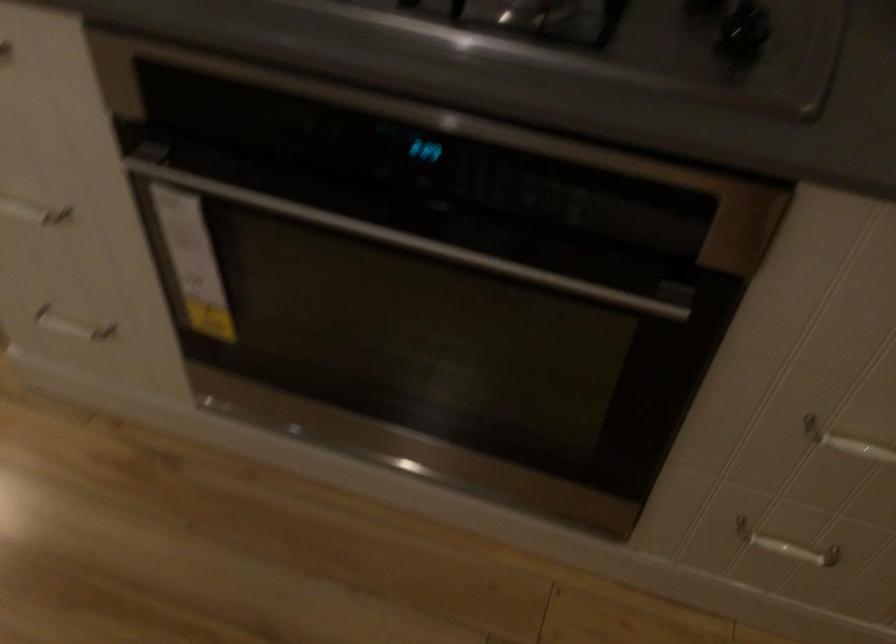
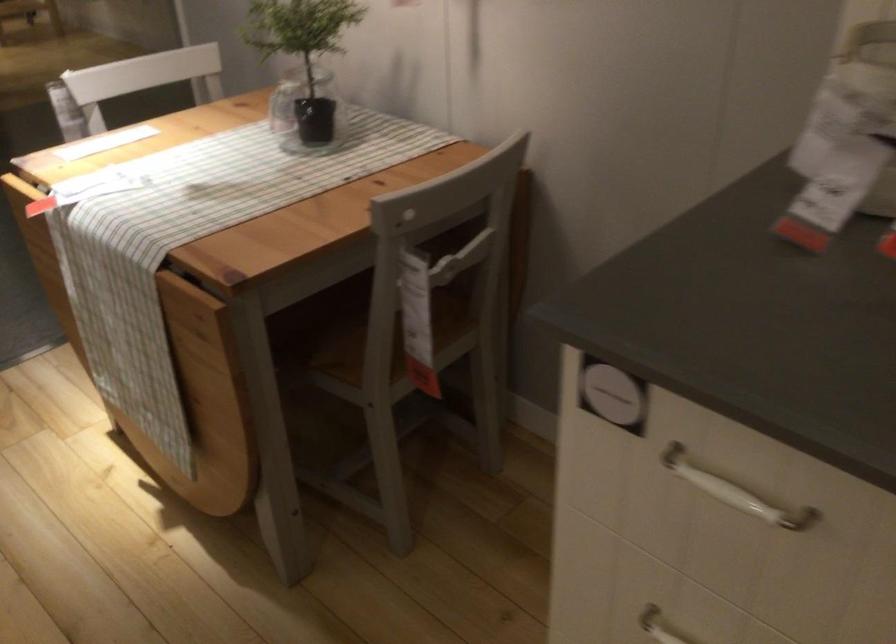
Question: Based on the continuous images, in which direction is the camera rotating? Reply with the corresponding letter.

Choices:
 (A) Left
 (B) Right
 (C) Up
 (D) Down

Answer: (A)